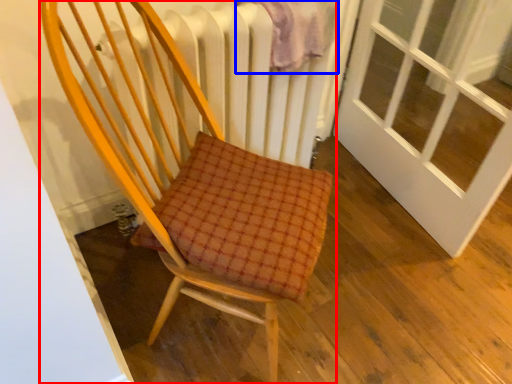
Question: Which point is closer to the camera, chair (highlighted by a red box) or blanket (highlighted by a blue box)?

Choices:
 (A) chair
 (B) blanket

Answer: (A)